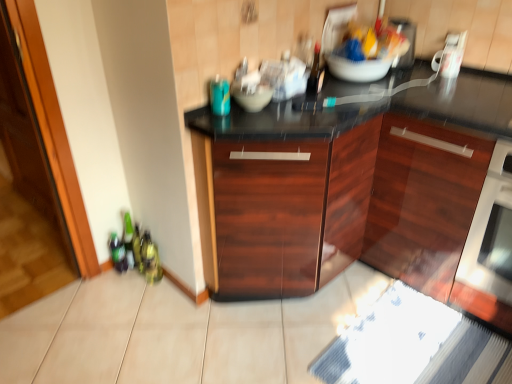
Where is `vacant space to the right of matte gray bowl at center`? The image size is (512, 384). vacant space to the right of matte gray bowl at center is located at coordinates (x=296, y=107).